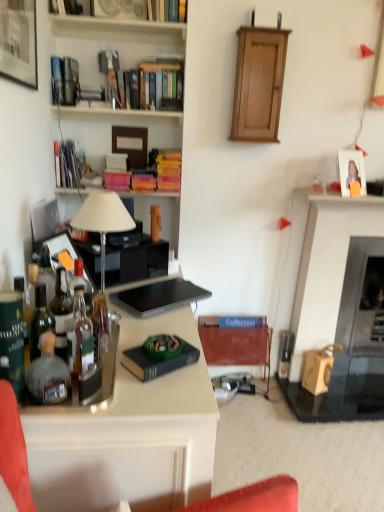
Question: Is hardcover book at upper center, marked as the eighth book in a bottom-to-top arrangement, to the left of wooden bookshelf at upper center, the 3th shelf ordered from the bottom, from the viewer's perspective?

Choices:
 (A) yes
 (B) no

Answer: (B)

Question: Considering the relative sizes of hardcover book at upper center, marked as the eighth book in a bottom-to-top arrangement, and wooden bookshelf at upper center, which ranks as the first shelf in top-to-bottom order, in the image provided, is hardcover book at upper center, marked as the eighth book in a bottom-to-top arrangement, wider than wooden bookshelf at upper center, which ranks as the first shelf in top-to-bottom order,?

Choices:
 (A) yes
 (B) no

Answer: (B)

Question: From a real-world perspective, is hardcover book at upper center, placed as the 1th book when sorted from top to bottom, positioned over wooden bookshelf at upper center, which ranks as the first shelf in top-to-bottom order, based on gravity?

Choices:
 (A) no
 (B) yes

Answer: (B)

Question: From the image's perspective, does hardcover book at upper center, placed as the 1th book when sorted from top to bottom, appear higher than wooden bookshelf at upper center, which ranks as the first shelf in top-to-bottom order?

Choices:
 (A) no
 (B) yes

Answer: (B)

Question: Is hardcover book at upper center, placed as the 1th book when sorted from top to bottom, not close to wooden bookshelf at upper center, which ranks as the first shelf in top-to-bottom order?

Choices:
 (A) no
 (B) yes

Answer: (A)

Question: Considering the positions of wooden fireplace at right and translucent glass bottle at left, which is the first bottle in front-to-back order, in the image, is wooden fireplace at right wider or thinner than translucent glass bottle at left, which is the first bottle in front-to-back order,?

Choices:
 (A) thin
 (B) wide

Answer: (B)

Question: From the image's perspective, is wooden fireplace at right above or below translucent glass bottle at left, which is the first bottle in front-to-back order?

Choices:
 (A) below
 (B) above

Answer: (B)

Question: In the image, is wooden fireplace at right on the left side or the right side of translucent glass bottle at left, which ranks as the fourth bottle in back-to-front order?

Choices:
 (A) right
 (B) left

Answer: (A)

Question: Is point (334, 211) positioned closer to the camera than point (41, 335)?

Choices:
 (A) farther
 (B) closer

Answer: (A)

Question: Would you say wooden bookshelf at upper center, the 3th shelf ordered from the bottom, is inside or outside hardcover book at upper left, which appears as the 6th book when ordered from the bottom?

Choices:
 (A) outside
 (B) inside

Answer: (A)

Question: In the image, is wooden bookshelf at upper center, which ranks as the first shelf in top-to-bottom order, positioned in front of or behind hardcover book at upper left, which is counted as the 3th book, starting from the top?

Choices:
 (A) behind
 (B) front

Answer: (B)

Question: In terms of height, does wooden bookshelf at upper center, which ranks as the first shelf in top-to-bottom order, look taller or shorter compared to hardcover book at upper left, which appears as the 6th book when ordered from the bottom?

Choices:
 (A) short
 (B) tall

Answer: (A)

Question: From a real-world perspective, relative to hardcover book at upper left, which is counted as the 3th book, starting from the top, is wooden bookshelf at upper center, the 3th shelf ordered from the bottom, vertically above or below?

Choices:
 (A) above
 (B) below

Answer: (A)

Question: Based on their positions, is wooden fireplace at right located to the left or right of matte black picture frame at upper left, which is the first picture frame from left to right?

Choices:
 (A) right
 (B) left

Answer: (A)

Question: Relative to matte black picture frame at upper left, which is counted as the second picture frame, starting from the right, is wooden fireplace at right in front or behind?

Choices:
 (A) behind
 (B) front

Answer: (A)